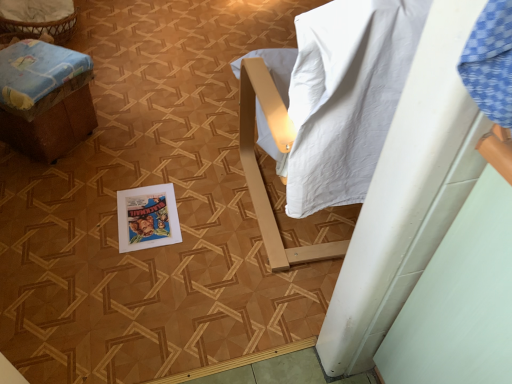
Question: From a real-world perspective, is brown cardboard box at left under vivid poster at center?

Choices:
 (A) no
 (B) yes

Answer: (A)

Question: From the image's perspective, is brown cardboard box at left below vivid poster at center?

Choices:
 (A) no
 (B) yes

Answer: (A)

Question: Does brown cardboard box at left have a lesser height compared to vivid poster at center?

Choices:
 (A) no
 (B) yes

Answer: (A)

Question: Considering the relative positions of brown cardboard box at left and vivid poster at center in the image provided, is brown cardboard box at left behind vivid poster at center?

Choices:
 (A) yes
 (B) no

Answer: (B)

Question: From the image's perspective, does brown cardboard box at left appear higher than vivid poster at center?

Choices:
 (A) yes
 (B) no

Answer: (A)

Question: Could you tell me if brown cardboard box at left is turned towards vivid poster at center?

Choices:
 (A) no
 (B) yes

Answer: (A)

Question: Does vivid poster at center appear on the right side of brown cardboard box at left?

Choices:
 (A) no
 (B) yes

Answer: (B)

Question: Can you confirm if vivid poster at center is wider than brown cardboard box at left?

Choices:
 (A) yes
 (B) no

Answer: (B)

Question: From a real-world perspective, is vivid poster at center under brown cardboard box at left?

Choices:
 (A) no
 (B) yes

Answer: (B)

Question: Is vivid poster at center positioned behind brown cardboard box at left?

Choices:
 (A) no
 (B) yes

Answer: (B)

Question: From the image's perspective, does vivid poster at center appear lower than brown cardboard box at left?

Choices:
 (A) no
 (B) yes

Answer: (B)

Question: Considering the relative sizes of vivid poster at center and brown cardboard box at left in the image provided, is vivid poster at center thinner than brown cardboard box at left?

Choices:
 (A) yes
 (B) no

Answer: (A)

Question: Would you say vivid poster at center is inside or outside brown cardboard box at left?

Choices:
 (A) inside
 (B) outside

Answer: (B)